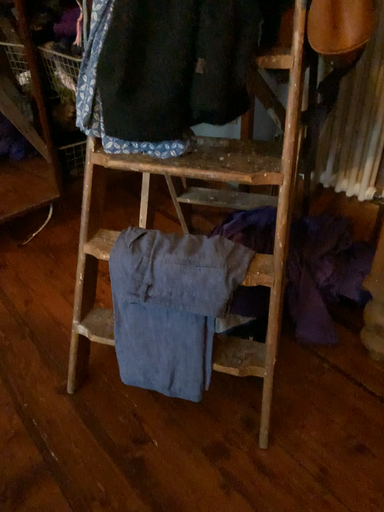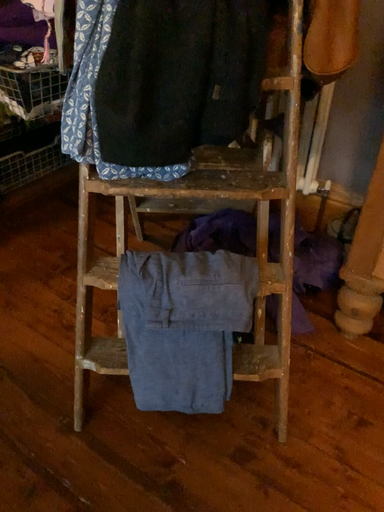
Question: How did the camera likely rotate when shooting the video?

Choices:
 (A) rotated left
 (B) rotated right

Answer: (B)